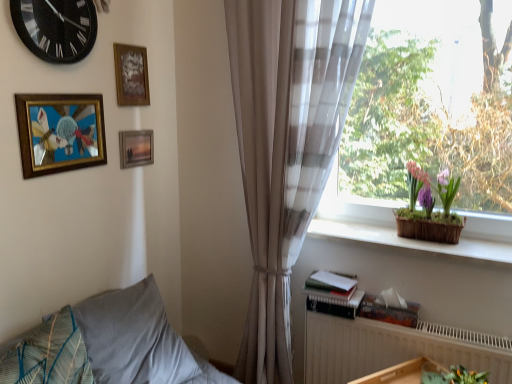
Question: Is wooden frame at upper center, acting as the second picture frame starting from the back, oriented towards gold-framed artwork at upper left, positioned as the first picture frame in front-to-back order?

Choices:
 (A) no
 (B) yes

Answer: (A)

Question: Is wooden frame at upper center, acting as the second picture frame starting from the back, located outside gold-framed artwork at upper left, positioned as the first picture frame in front-to-back order?

Choices:
 (A) no
 (B) yes

Answer: (B)

Question: Is wooden frame at upper center, acting as the second picture frame starting from the front, further to the viewer compared to gold-framed artwork at upper left, which is the third picture frame in back-to-front order?

Choices:
 (A) yes
 (B) no

Answer: (A)

Question: Would you say wooden frame at upper center, acting as the second picture frame starting from the back, is a long distance from gold-framed artwork at upper left, which is the third picture frame in back-to-front order?

Choices:
 (A) yes
 (B) no

Answer: (B)

Question: Is wooden frame at upper center, acting as the second picture frame starting from the back, next to gold-framed artwork at upper left, positioned as the first picture frame in front-to-back order?

Choices:
 (A) no
 (B) yes

Answer: (A)

Question: Can you confirm if wooden frame at upper center, acting as the second picture frame starting from the front, is shorter than gold-framed artwork at upper left, which is the third picture frame in back-to-front order?

Choices:
 (A) yes
 (B) no

Answer: (A)

Question: Is gray fabric pillow at lower left, which ranks as the 1th pillow in back-to-front order, next to textured blue pillow at lower left, the 2th pillow in the back-to-front sequence, and touching it?

Choices:
 (A) no
 (B) yes

Answer: (A)

Question: Does gray fabric pillow at lower left, which ranks as the 2th pillow in front-to-back order, have a larger size compared to textured blue pillow at lower left, which is the 1th pillow in front-to-back order?

Choices:
 (A) yes
 (B) no

Answer: (A)

Question: Does gray fabric pillow at lower left, which ranks as the 2th pillow in front-to-back order, appear on the right side of textured blue pillow at lower left, which is the 1th pillow in front-to-back order?

Choices:
 (A) no
 (B) yes

Answer: (B)

Question: Considering the relative sizes of gray fabric pillow at lower left, which ranks as the 2th pillow in front-to-back order, and textured blue pillow at lower left, which is the 1th pillow in front-to-back order, in the image provided, is gray fabric pillow at lower left, which ranks as the 2th pillow in front-to-back order, shorter than textured blue pillow at lower left, which is the 1th pillow in front-to-back order,?

Choices:
 (A) yes
 (B) no

Answer: (B)

Question: Is gray fabric pillow at lower left, which ranks as the 2th pillow in front-to-back order, positioned in front of textured blue pillow at lower left, which is the 1th pillow in front-to-back order?

Choices:
 (A) no
 (B) yes

Answer: (A)

Question: Would you say gray fabric pillow at lower left, which ranks as the 2th pillow in front-to-back order, is outside textured blue pillow at lower left, the 2th pillow in the back-to-front sequence?

Choices:
 (A) no
 (B) yes

Answer: (B)

Question: Is the depth of white textured radiator at lower right less than that of gold-framed artwork at upper left, which is the third picture frame in back-to-front order?

Choices:
 (A) yes
 (B) no

Answer: (B)